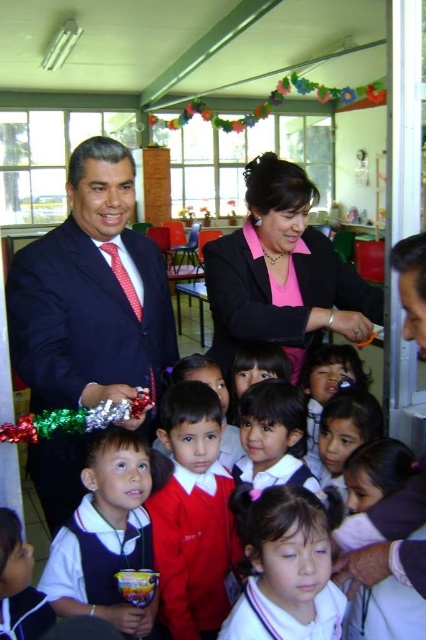
Question: Among these objects, which one is farthest from the camera?

Choices:
 (A) white glossy shirt at center
 (B) red dotted tie at left
 (C) white uniform at center

Answer: (B)

Question: Does white uniform at center appear over red dotted tie at left?

Choices:
 (A) yes
 (B) no

Answer: (B)

Question: From the image, what is the correct spatial relationship of pink matte blazer at center in relation to white glossy shirt at center?

Choices:
 (A) right
 (B) left

Answer: (A)

Question: Which of the following is the farthest from the observer?

Choices:
 (A) red dotted tie at left
 (B) matte black uniform at center
 (C) shiny dark blue suit at left

Answer: (A)

Question: Which point is closer to the camera?

Choices:
 (A) white uniform at center
 (B) white matte uniform at center

Answer: (A)

Question: Does shiny dark blue suit at left appear under pink matte blazer at center?

Choices:
 (A) no
 (B) yes

Answer: (B)